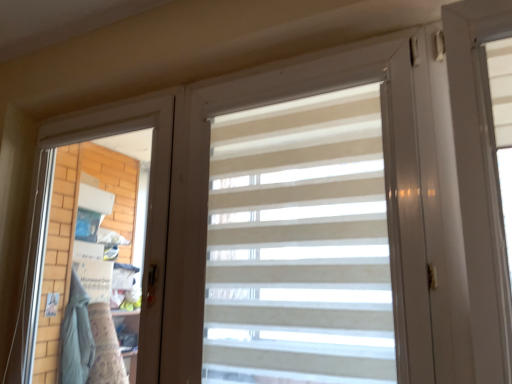
Question: Visually, is white matte screen door at left positioned to the left or to the right of beige striped curtain at center?

Choices:
 (A) right
 (B) left

Answer: (B)

Question: Is white matte screen door at left in front of or behind beige striped curtain at center in the image?

Choices:
 (A) front
 (B) behind

Answer: (B)

Question: Looking at the image, does white matte screen door at left seem bigger or smaller compared to beige striped curtain at center?

Choices:
 (A) small
 (B) big

Answer: (B)

Question: From a real-world perspective, is beige striped curtain at center physically located above or below white matte screen door at left?

Choices:
 (A) below
 (B) above

Answer: (B)

Question: From the image's perspective, is beige striped curtain at center positioned above or below white matte screen door at left?

Choices:
 (A) above
 (B) below

Answer: (A)

Question: Looking at the image, does beige striped curtain at center seem bigger or smaller compared to white matte screen door at left?

Choices:
 (A) big
 (B) small

Answer: (B)

Question: Considering the relative positions of beige striped curtain at center and white matte screen door at left in the image provided, is beige striped curtain at center to the left or to the right of white matte screen door at left?

Choices:
 (A) right
 (B) left

Answer: (A)